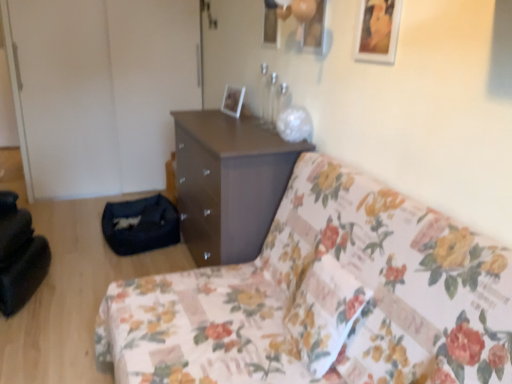
What do you see at coordinates (378, 30) in the screenshot? The image size is (512, 384). I see `wooden picture frame at upper right, which appears as the first picture frame when viewed from the front` at bounding box center [378, 30].

This screenshot has width=512, height=384. In order to click on wooden picture frame at upper right, which appears as the first picture frame when viewed from the front in this screenshot , I will do `click(378, 30)`.

What is the approximate width of floral fabric couch at center?

1.13 meters.

Find the location of a particular element. Image resolution: width=512 pixels, height=384 pixels. white glossy picture frame at upper center, positioned as the first picture frame in back-to-front order is located at coordinates (233, 100).

Visually, is floral fabric couch at center positioned to the left or to the right of wooden picture frame at upper right, positioned as the 2th picture frame in left-to-right order?

In the image, floral fabric couch at center appears on the left side of wooden picture frame at upper right, positioned as the 2th picture frame in left-to-right order.

Is floral fabric couch at center taller or shorter than wooden picture frame at upper right, the 1th picture frame viewed from the right?

Clearly, floral fabric couch at center is taller compared to wooden picture frame at upper right, the 1th picture frame viewed from the right.

Does floral fabric couch at center turn towards wooden picture frame at upper right, which appears as the first picture frame when viewed from the front?

No, floral fabric couch at center is not facing towards wooden picture frame at upper right, which appears as the first picture frame when viewed from the front.

Is floral fabric couch at center not within wooden picture frame at upper right, the 2th picture frame from the back?

Yes, floral fabric couch at center is outside of wooden picture frame at upper right, the 2th picture frame from the back.

Which object is closer to the camera, wooden picture frame at upper right, the 2th picture frame from the back, or floral fabric couch at center?

floral fabric couch at center is in front.

From their relative heights in the image, would you say wooden picture frame at upper right, the 2th picture frame from the back, is taller or shorter than floral fabric couch at center?

Clearly, wooden picture frame at upper right, the 2th picture frame from the back, is shorter compared to floral fabric couch at center.

How different are the orientations of wooden picture frame at upper right, the 2th picture frame from the back, and floral fabric couch at center in degrees?

The facing directions of wooden picture frame at upper right, the 2th picture frame from the back, and floral fabric couch at center are 1.54 degrees apart.

From a real-world perspective, relative to floral fabric couch at center, is wooden picture frame at upper right, the 1th picture frame viewed from the right, vertically above or below?

wooden picture frame at upper right, the 1th picture frame viewed from the right, is situated higher than floral fabric couch at center in the real world.

Which object is closer to the camera, matte brown chest of drawers at center or floral fabric couch at center?

Positioned in front is floral fabric couch at center.

Is matte brown chest of drawers at center thinner than floral fabric couch at center?

Indeed, matte brown chest of drawers at center has a lesser width compared to floral fabric couch at center.

Between matte brown chest of drawers at center and floral fabric couch at center, which one has smaller size?

With smaller size is matte brown chest of drawers at center.

Is matte brown chest of drawers at center positioned far away from floral fabric couch at center?

No, there isn't a large distance between matte brown chest of drawers at center and floral fabric couch at center.

Is white glossy picture frame at upper center, which appears as the first picture frame when viewed from the left, at the back of floral fabric couch at center?

floral fabric couch at center is not turned away from white glossy picture frame at upper center, which appears as the first picture frame when viewed from the left.

Does floral fabric couch at center lie in front of white glossy picture frame at upper center, which appears as the first picture frame when viewed from the left?

Yes, the depth of floral fabric couch at center is less than that of white glossy picture frame at upper center, which appears as the first picture frame when viewed from the left.

Considering the relative sizes of floral fabric couch at center and white glossy picture frame at upper center, which appears as the first picture frame when viewed from the left, in the image provided, is floral fabric couch at center taller than white glossy picture frame at upper center, which appears as the first picture frame when viewed from the left,?

Yes.

Which object is positioned more to the right, floral fabric couch at center or white glossy picture frame at upper center, marked as the 2th picture frame in a right-to-left arrangement?

Positioned to the right is floral fabric couch at center.

Does wooden picture frame at upper right, which appears as the first picture frame when viewed from the front, have a lesser height compared to white glossy picture frame at upper center, acting as the 2th picture frame starting from the front?

No, wooden picture frame at upper right, which appears as the first picture frame when viewed from the front, is not shorter than white glossy picture frame at upper center, acting as the 2th picture frame starting from the front.

Looking at their sizes, would you say wooden picture frame at upper right, positioned as the 2th picture frame in left-to-right order, is wider or thinner than white glossy picture frame at upper center, positioned as the first picture frame in back-to-front order?

Considering their sizes, wooden picture frame at upper right, positioned as the 2th picture frame in left-to-right order, looks slimmer than white glossy picture frame at upper center, positioned as the first picture frame in back-to-front order.

From the image's perspective, is wooden picture frame at upper right, which appears as the first picture frame when viewed from the front, located above white glossy picture frame at upper center, which appears as the first picture frame when viewed from the left?

Indeed, from the image's perspective, wooden picture frame at upper right, which appears as the first picture frame when viewed from the front, is shown above white glossy picture frame at upper center, which appears as the first picture frame when viewed from the left.

Consider the image. How many degrees apart are the facing directions of wooden picture frame at upper right, the 2th picture frame from the back, and white glossy picture frame at upper center, which appears as the first picture frame when viewed from the left?

3.88 degrees.

Which of these two, matte brown chest of drawers at center or wooden picture frame at upper right, the 2th picture frame from the back, is wider?

With larger width is matte brown chest of drawers at center.

Is the depth of matte brown chest of drawers at center less than that of wooden picture frame at upper right, the 1th picture frame viewed from the right?

No, it is behind wooden picture frame at upper right, the 1th picture frame viewed from the right.

In terms of size, does matte brown chest of drawers at center appear bigger or smaller than wooden picture frame at upper right, which appears as the first picture frame when viewed from the front?

Considering their sizes, matte brown chest of drawers at center takes up more space than wooden picture frame at upper right, which appears as the first picture frame when viewed from the front.

From a real-world perspective, who is located lower, white glossy picture frame at upper center, positioned as the first picture frame in back-to-front order, or matte brown chest of drawers at center?

In real-world perspective, matte brown chest of drawers at center is lower.

Is white glossy picture frame at upper center, which appears as the first picture frame when viewed from the left, touching matte brown chest of drawers at center?

No, white glossy picture frame at upper center, which appears as the first picture frame when viewed from the left, is not with matte brown chest of drawers at center.

Could you tell me if white glossy picture frame at upper center, which appears as the first picture frame when viewed from the left, is facing matte brown chest of drawers at center?

No, white glossy picture frame at upper center, which appears as the first picture frame when viewed from the left, does not turn towards matte brown chest of drawers at center.

Is matte brown chest of drawers at center located within white glossy picture frame at upper center, which appears as the first picture frame when viewed from the left?

No, white glossy picture frame at upper center, which appears as the first picture frame when viewed from the left, does not contain matte brown chest of drawers at center.

The image size is (512, 384). I want to click on studio couch located in front of the wooden picture frame at upper right, the 2th picture frame from the back, so click(x=325, y=298).

I want to click on picture frame that is on the right side of floral fabric couch at center, so click(x=378, y=30).

From the image, which object appears to be nearer to floral fabric couch at center, wooden picture frame at upper right, the 2th picture frame from the back, or matte brown chest of drawers at center?

Among the two, matte brown chest of drawers at center is located nearer to floral fabric couch at center.

Estimate the real-world distances between objects in this image. Which object is further from wooden picture frame at upper right, the 2th picture frame from the back, floral fabric couch at center or white glossy picture frame at upper center, positioned as the first picture frame in back-to-front order?

Based on the image, white glossy picture frame at upper center, positioned as the first picture frame in back-to-front order, appears to be further to wooden picture frame at upper right, the 2th picture frame from the back.

In the scene shown: Which object lies further to the anchor point wooden picture frame at upper right, the 1th picture frame viewed from the right, floral fabric couch at center or matte brown chest of drawers at center?

Among the two, matte brown chest of drawers at center is located further to wooden picture frame at upper right, the 1th picture frame viewed from the right.

Considering their positions, is white glossy picture frame at upper center, marked as the 2th picture frame in a right-to-left arrangement, positioned closer to floral fabric couch at center than matte brown chest of drawers at center?

matte brown chest of drawers at center is positioned closer to the anchor floral fabric couch at center.

Looking at this image, from the image, which object appears to be nearer to matte brown chest of drawers at center, floral fabric couch at center or wooden picture frame at upper right, the 2th picture frame from the back?

floral fabric couch at center is closer to matte brown chest of drawers at center.

From the image, which object appears to be nearer to wooden picture frame at upper right, which appears as the first picture frame when viewed from the front, matte brown chest of drawers at center or floral fabric couch at center?

floral fabric couch at center is closer to wooden picture frame at upper right, which appears as the first picture frame when viewed from the front.

Which object lies nearer to the anchor point white glossy picture frame at upper center, which appears as the first picture frame when viewed from the left, floral fabric couch at center or matte brown chest of drawers at center?

Among the two, matte brown chest of drawers at center is located nearer to white glossy picture frame at upper center, which appears as the first picture frame when viewed from the left.

Considering their positions, is matte brown chest of drawers at center positioned further to white glossy picture frame at upper center, positioned as the first picture frame in back-to-front order, than floral fabric couch at center?

floral fabric couch at center is further to white glossy picture frame at upper center, positioned as the first picture frame in back-to-front order.

This screenshot has height=384, width=512. I want to click on chest of drawers between wooden picture frame at upper right, positioned as the 2th picture frame in left-to-right order, and white glossy picture frame at upper center, acting as the 2th picture frame starting from the front, from front to back, so click(x=229, y=183).

I want to click on picture frame between floral fabric couch at center and white glossy picture frame at upper center, positioned as the first picture frame in back-to-front order, in the front-back direction, so click(378, 30).

The image size is (512, 384). I want to click on chest of drawers between floral fabric couch at center and white glossy picture frame at upper center, acting as the 2th picture frame starting from the front, from front to back, so click(229, 183).

The height and width of the screenshot is (384, 512). I want to click on picture frame between floral fabric couch at center and matte brown chest of drawers at center from front to back, so click(x=378, y=30).